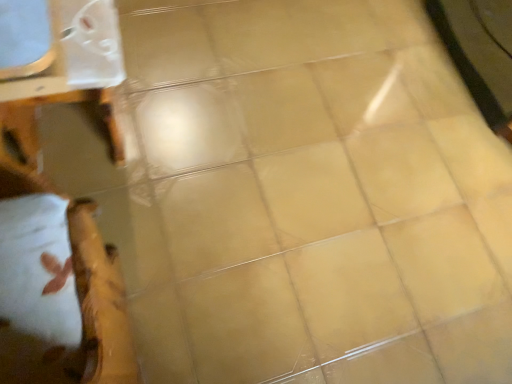
The image size is (512, 384). Find the location of `vacant area to the right of wooden table at left`. vacant area to the right of wooden table at left is located at coordinates (174, 170).